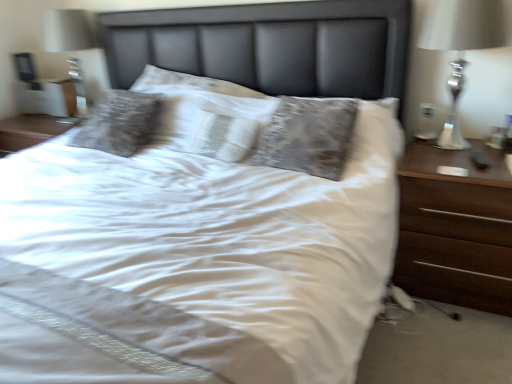
Image resolution: width=512 pixels, height=384 pixels. Identify the location of blank space situated above dark wood nightstand at right (from a real-world perspective). (474, 157).